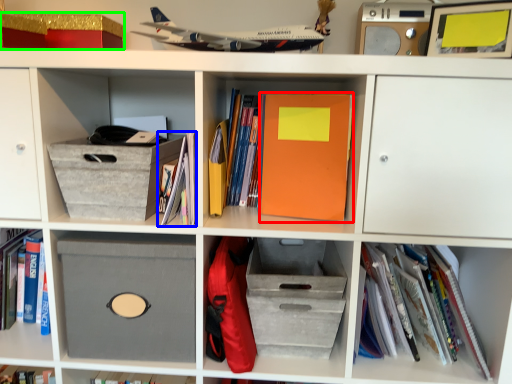
Question: Which object is the farthest from paperback book (highlighted by a red box)? Choose among these: book (highlighted by a blue box) or storage box (highlighted by a green box).

Choices:
 (A) book
 (B) storage box

Answer: (B)